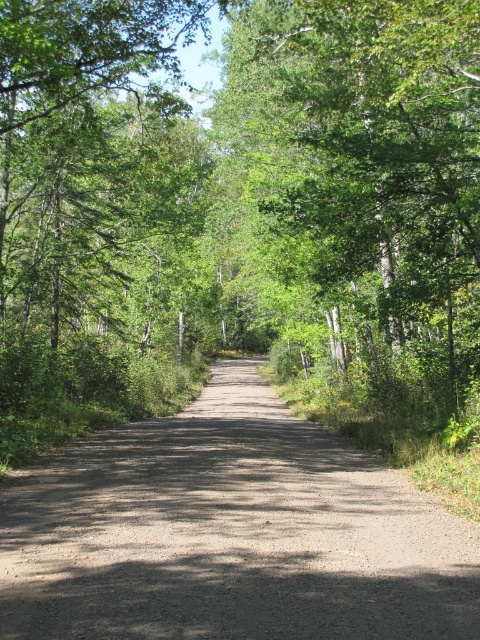
You are standing at the starting point of the forest path and see the point marked as point [247,179]. What object does this point correspond to?

The point [247,179] corresponds to the green leafy tree at center.